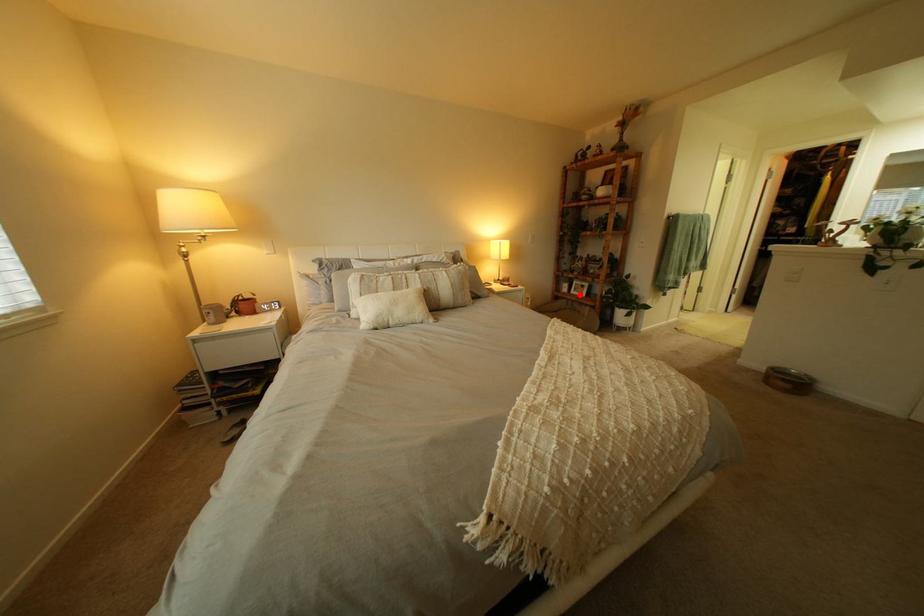
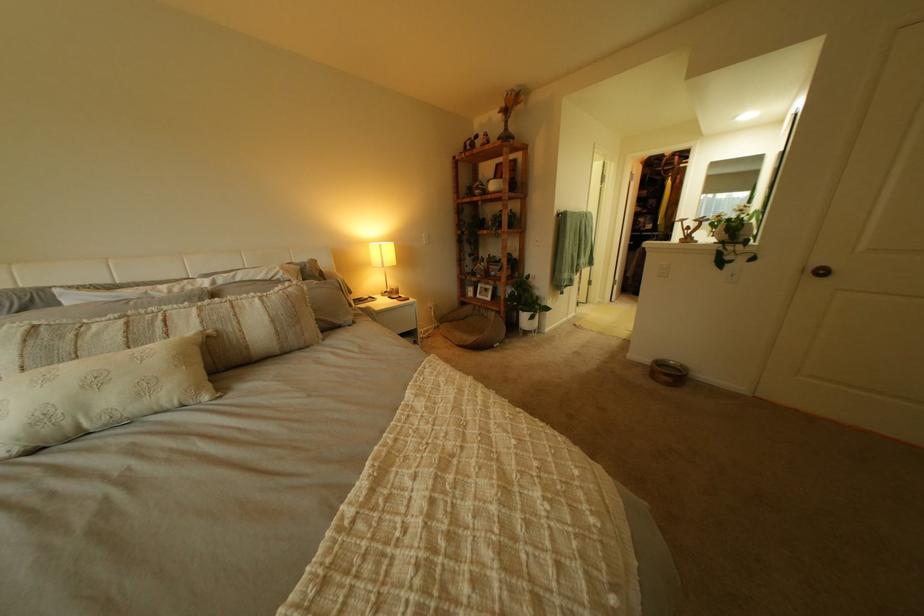
In the second image, find the point that corresponds to the highlighted location in the first image.

(485, 300)